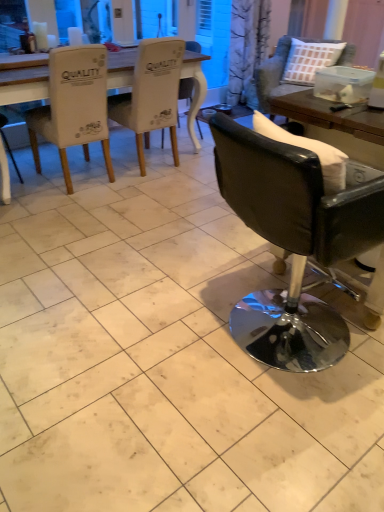
Where is `free spot in front of white fabric chair at upper left, the fifth chair viewed from the right`? free spot in front of white fabric chair at upper left, the fifth chair viewed from the right is located at coordinates [x=78, y=212].